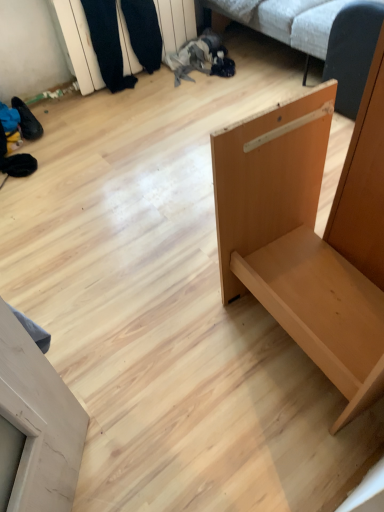
Question: Is wooden shelf at upper left thinner than white fabric couch at upper center?

Choices:
 (A) no
 (B) yes

Answer: (B)

Question: Would you say wooden shelf at upper left is outside white fabric couch at upper center?

Choices:
 (A) yes
 (B) no

Answer: (A)

Question: From the image's perspective, is wooden shelf at upper left located above white fabric couch at upper center?

Choices:
 (A) yes
 (B) no

Answer: (B)

Question: Considering the relative positions of wooden shelf at upper left and white fabric couch at upper center in the image provided, is wooden shelf at upper left to the left of white fabric couch at upper center from the viewer's perspective?

Choices:
 (A) yes
 (B) no

Answer: (A)

Question: Is white fabric couch at upper center located within wooden shelf at upper left?

Choices:
 (A) yes
 (B) no

Answer: (B)

Question: Considering their positions, is light brown wood shelf at right, which is the 2th furniture from left to right, located in front of or behind light brown wood door at lower left, which is counted as the first furniture, starting from the left?

Choices:
 (A) behind
 (B) front

Answer: (A)

Question: From a real-world perspective, is light brown wood shelf at right, which is the 2th furniture from left to right, positioned above or below light brown wood door at lower left, which is counted as the first furniture, starting from the left?

Choices:
 (A) above
 (B) below

Answer: (B)

Question: Is light brown wood shelf at right, which is the 2th furniture from left to right, taller or shorter than light brown wood door at lower left, which is counted as the first furniture, starting from the left?

Choices:
 (A) short
 (B) tall

Answer: (B)

Question: From the image's perspective, is light brown wood shelf at right, the 1th furniture from the right, positioned above or below light brown wood door at lower left, which is counted as the first furniture, starting from the left?

Choices:
 (A) below
 (B) above

Answer: (B)

Question: Considering the positions of wooden shelf at upper left and white fabric couch at upper center in the image, is wooden shelf at upper left taller or shorter than white fabric couch at upper center?

Choices:
 (A) tall
 (B) short

Answer: (B)

Question: Choose the correct answer: Is wooden shelf at upper left inside white fabric couch at upper center or outside it?

Choices:
 (A) inside
 (B) outside

Answer: (B)

Question: Considering the positions of wooden shelf at upper left and white fabric couch at upper center in the image, is wooden shelf at upper left wider or thinner than white fabric couch at upper center?

Choices:
 (A) thin
 (B) wide

Answer: (A)

Question: Is point (86, 51) closer or farther from the camera than point (273, 23)?

Choices:
 (A) closer
 (B) farther

Answer: (B)

Question: Does point (286, 111) appear closer or farther from the camera than point (170, 24)?

Choices:
 (A) farther
 (B) closer

Answer: (B)

Question: Which is correct: light brown wood shelf at right, which is the 2th furniture from left to right, is inside wooden shelf at upper left, or outside of it?

Choices:
 (A) outside
 (B) inside

Answer: (A)